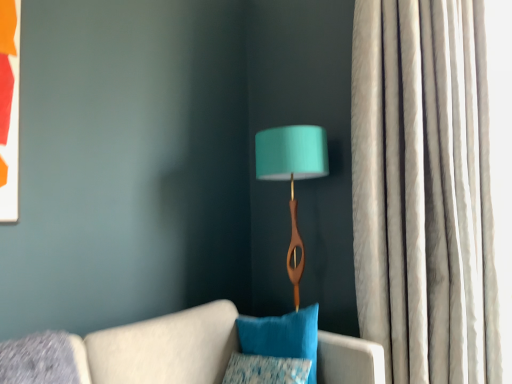
Measure the distance between teal fabric lampshade at center and camera.

A distance of 6.25 feet exists between teal fabric lampshade at center and camera.

What do you see at coordinates (292, 175) in the screenshot?
I see `teal fabric lampshade at center` at bounding box center [292, 175].

Identify the location of velvety blue pillow at center, placed as the 1th pillow when sorted from top to bottom. (282, 336).

At what (x,y) coordinates should I click in order to perform the action: click on teal fabric lampshade at center. Please return your answer as a coordinate pair (x, y). Image resolution: width=512 pixels, height=384 pixels. Looking at the image, I should click on (292, 175).

You are a GUI agent. You are given a task and a screenshot of the screen. Output one action in this format:
    pyautogui.click(x=<x>, y=<y>)
    Task: Click on the pillow that is on the left side of velvety blue pillow at center, placed as the 1th pillow when sorted from top to bottom
    
    Given the screenshot: What is the action you would take?
    pyautogui.click(x=266, y=370)

Between velvety blue pillow at center, placed as the 1th pillow when sorted from top to bottom, and textured blue pillow at lower center, placed as the first pillow when sorted from bottom to top, which one is positioned behind?

velvety blue pillow at center, placed as the 1th pillow when sorted from top to bottom, is behind.

From the image's perspective, does velvety blue pillow at center, placed as the 1th pillow when sorted from top to bottom, appear higher than textured blue pillow at lower center, placed as the first pillow when sorted from bottom to top?

Yes, from the image's perspective, velvety blue pillow at center, placed as the 1th pillow when sorted from top to bottom, is above textured blue pillow at lower center, placed as the first pillow when sorted from bottom to top.

From a real-world perspective, is textured blue pillow at lower center, placed as the first pillow when sorted from bottom to top, physically located above or below teal fabric lampshade at center?

textured blue pillow at lower center, placed as the first pillow when sorted from bottom to top, is below teal fabric lampshade at center.

Choose the correct answer: Is textured blue pillow at lower center, placed as the first pillow when sorted from bottom to top, inside teal fabric lampshade at center or outside it?

textured blue pillow at lower center, placed as the first pillow when sorted from bottom to top, is spatially situated outside teal fabric lampshade at center.

Is the depth of textured blue pillow at lower center, the second pillow from the top, less than that of teal fabric lampshade at center?

Yes, it is.

Is textured blue pillow at lower center, placed as the first pillow when sorted from bottom to top, taller than teal fabric lampshade at center?

In fact, textured blue pillow at lower center, placed as the first pillow when sorted from bottom to top, may be shorter than teal fabric lampshade at center.

Is textured blue pillow at lower center, the second pillow from the top, looking in the opposite direction of silky white curtain at right?

No, textured blue pillow at lower center, the second pillow from the top, is not facing away from silky white curtain at right.

Is point (284, 376) closer or farther from the camera than point (379, 81)?

Point (284, 376) appears to be closer to the viewer than point (379, 81).

Consider the image. Considering the relative sizes of textured blue pillow at lower center, the second pillow from the top, and silky white curtain at right in the image provided, is textured blue pillow at lower center, the second pillow from the top, smaller than silky white curtain at right?

Indeed, textured blue pillow at lower center, the second pillow from the top, has a smaller size compared to silky white curtain at right.

From a real-world perspective, is textured blue pillow at lower center, placed as the first pillow when sorted from bottom to top, positioned over silky white curtain at right based on gravity?

No, from a real-world perspective, textured blue pillow at lower center, placed as the first pillow when sorted from bottom to top, is not above silky white curtain at right.

Consider the image. Considering the relative positions of textured blue pillow at lower center, the second pillow from the top, and velvety blue pillow at center, the 2th pillow positioned from the bottom, in the image provided, is textured blue pillow at lower center, the second pillow from the top, behind velvety blue pillow at center, the 2th pillow positioned from the bottom,?

No, textured blue pillow at lower center, the second pillow from the top, is in front of velvety blue pillow at center, the 2th pillow positioned from the bottom.

From the image's perspective, relative to velvety blue pillow at center, the 2th pillow positioned from the bottom, is textured blue pillow at lower center, placed as the first pillow when sorted from bottom to top, above or below?

textured blue pillow at lower center, placed as the first pillow when sorted from bottom to top, is situated lower than velvety blue pillow at center, the 2th pillow positioned from the bottom, in the image.

Is textured blue pillow at lower center, placed as the first pillow when sorted from bottom to top, oriented away from velvety blue pillow at center, placed as the 1th pillow when sorted from top to bottom?

Correct, textured blue pillow at lower center, placed as the first pillow when sorted from bottom to top, is looking away from velvety blue pillow at center, placed as the 1th pillow when sorted from top to bottom.

Can you confirm if textured blue pillow at lower center, placed as the first pillow when sorted from bottom to top, is wider than velvety blue pillow at center, the 2th pillow positioned from the bottom?

No.

Is velvety blue pillow at center, placed as the 1th pillow when sorted from top to bottom, surrounding teal fabric lampshade at center?

No.

Is velvety blue pillow at center, the 2th pillow positioned from the bottom, aimed at teal fabric lampshade at center?

→ No.

Locate an element on the screen. This screenshot has width=512, height=384. lamp that is above the velvety blue pillow at center, the 2th pillow positioned from the bottom (from the image's perspective) is located at coordinates 292,175.

From the image's perspective, does velvety blue pillow at center, placed as the 1th pillow when sorted from top to bottom, appear lower than teal fabric lampshade at center?

Yes.

From a real-world perspective, which is physically above, teal fabric lampshade at center or silky white curtain at right?

silky white curtain at right, from a real-world perspective.

Does teal fabric lampshade at center have a lesser height compared to silky white curtain at right?

Yes, teal fabric lampshade at center is shorter than silky white curtain at right.

How many degrees apart are the facing directions of teal fabric lampshade at center and silky white curtain at right?

50.5 degrees separate the facing orientations of teal fabric lampshade at center and silky white curtain at right.

Is teal fabric lampshade at center positioned with its back to silky white curtain at right?

No, teal fabric lampshade at center's orientation is not away from silky white curtain at right.

Is there a large distance between silky white curtain at right and velvety blue pillow at center, placed as the 1th pillow when sorted from top to bottom?

That's not correct — silky white curtain at right is a little close to velvety blue pillow at center, placed as the 1th pillow when sorted from top to bottom.

From the image's perspective, between silky white curtain at right and velvety blue pillow at center, the 2th pillow positioned from the bottom, which one is located above?

silky white curtain at right is shown above in the image.

Which is further, (447, 142) or (316, 329)?

The point (447, 142) is farther from the camera.

Is silky white curtain at right bigger than velvety blue pillow at center, placed as the 1th pillow when sorted from top to bottom?

Yes, silky white curtain at right is bigger than velvety blue pillow at center, placed as the 1th pillow when sorted from top to bottom.

Where is `pillow to the left of velvety blue pillow at center, placed as the 1th pillow when sorted from top to bottom`? This screenshot has height=384, width=512. pillow to the left of velvety blue pillow at center, placed as the 1th pillow when sorted from top to bottom is located at coordinates (266, 370).

Locate an element on the screen. Image resolution: width=512 pixels, height=384 pixels. the 2nd pillow below the teal fabric lampshade at center (from the image's perspective) is located at coordinates (x=266, y=370).

From the image, which object appears to be farther from teal fabric lampshade at center, silky white curtain at right or textured blue pillow at lower center, the second pillow from the top?

Based on the image, textured blue pillow at lower center, the second pillow from the top, appears to be further to teal fabric lampshade at center.

Looking at this image, when comparing their distances from silky white curtain at right, does teal fabric lampshade at center or textured blue pillow at lower center, placed as the first pillow when sorted from bottom to top, seem closer?

Among the two, teal fabric lampshade at center is located nearer to silky white curtain at right.

When comparing their distances from silky white curtain at right, does textured blue pillow at lower center, placed as the first pillow when sorted from bottom to top, or teal fabric lampshade at center seem closer?

Based on the image, teal fabric lampshade at center appears to be nearer to silky white curtain at right.

Based on their spatial positions, is textured blue pillow at lower center, placed as the first pillow when sorted from bottom to top, or velvety blue pillow at center, the 2th pillow positioned from the bottom, further from teal fabric lampshade at center?

The object further to teal fabric lampshade at center is textured blue pillow at lower center, placed as the first pillow when sorted from bottom to top.

Estimate the real-world distances between objects in this image. Which object is closer to teal fabric lampshade at center, velvety blue pillow at center, placed as the 1th pillow when sorted from top to bottom, or silky white curtain at right?

velvety blue pillow at center, placed as the 1th pillow when sorted from top to bottom.

Looking at the image, which one is located closer to textured blue pillow at lower center, the second pillow from the top, velvety blue pillow at center, placed as the 1th pillow when sorted from top to bottom, or silky white curtain at right?

velvety blue pillow at center, placed as the 1th pillow when sorted from top to bottom, is positioned closer to the anchor textured blue pillow at lower center, the second pillow from the top.

Which object lies nearer to the anchor point silky white curtain at right, teal fabric lampshade at center or velvety blue pillow at center, placed as the 1th pillow when sorted from top to bottom?

Among the two, teal fabric lampshade at center is located nearer to silky white curtain at right.

Considering their positions, is teal fabric lampshade at center positioned closer to textured blue pillow at lower center, placed as the first pillow when sorted from bottom to top, than silky white curtain at right?

teal fabric lampshade at center lies closer to textured blue pillow at lower center, placed as the first pillow when sorted from bottom to top, than the other object.

Find the location of a particular element. Image resolution: width=512 pixels, height=384 pixels. pillow situated between textured blue pillow at lower center, the second pillow from the top, and silky white curtain at right from left to right is located at coordinates (282, 336).

Image resolution: width=512 pixels, height=384 pixels. I want to click on pillow between teal fabric lampshade at center and textured blue pillow at lower center, placed as the first pillow when sorted from bottom to top, in the vertical direction, so click(282, 336).

Identify the location of lamp situated between velvety blue pillow at center, the 2th pillow positioned from the bottom, and silky white curtain at right from left to right. (292, 175).

The width and height of the screenshot is (512, 384). In order to click on lamp between textured blue pillow at lower center, the second pillow from the top, and silky white curtain at right from left to right in this screenshot , I will do `click(292, 175)`.